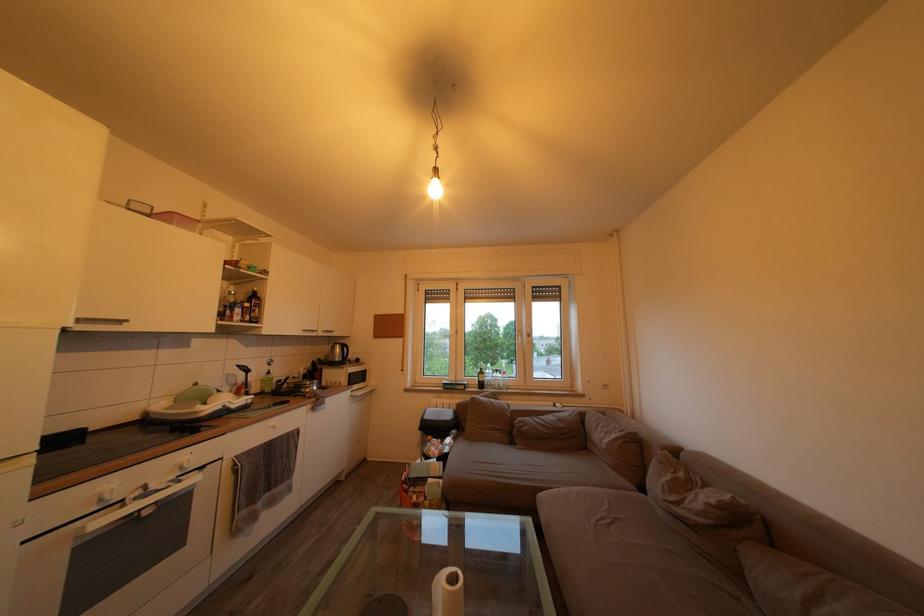
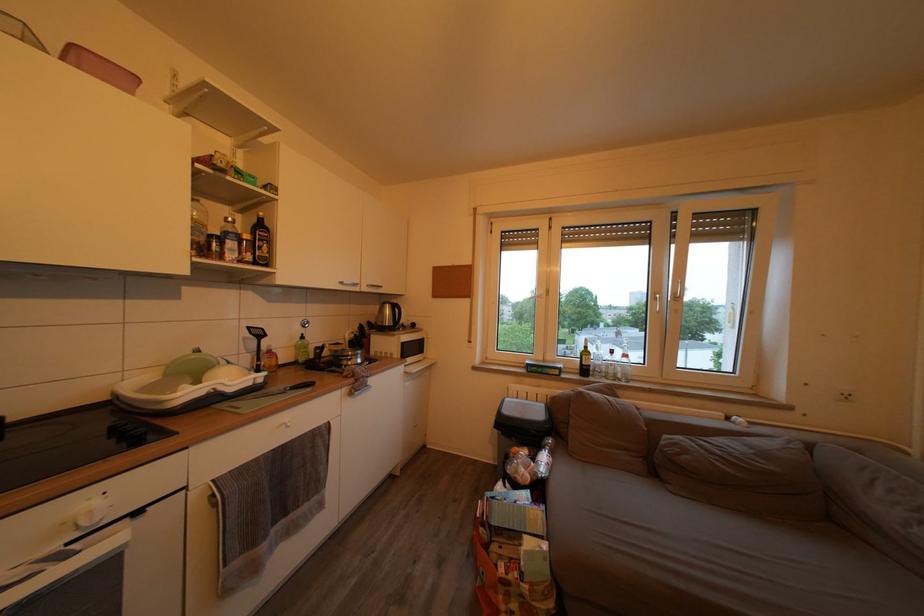
Locate, in the second image, the point that corresponds to [241,413] in the first image.

(238, 397)